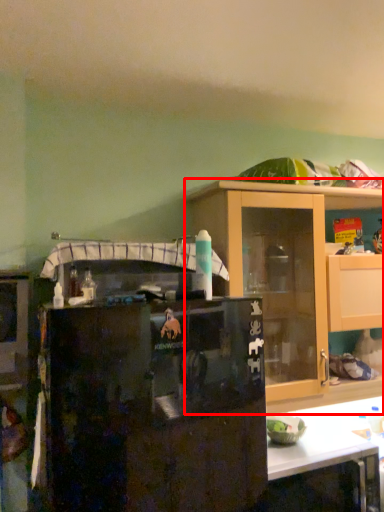
Question: From the image's perspective, what is the correct spatial relationship of cabinetry (annotated by the red box) in relation to refrigerator?

Choices:
 (A) below
 (B) above

Answer: (B)